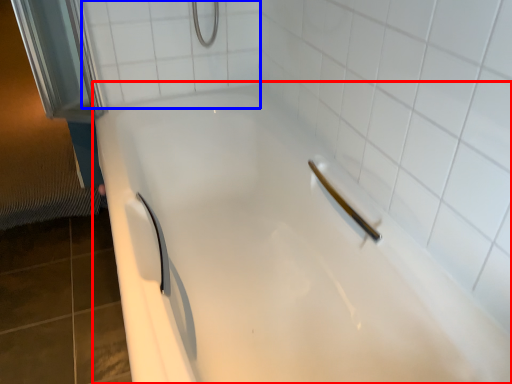
Question: Which object appears farthest to the camera in this image, bathtub (highlighted by a red box) or ceramic tile (highlighted by a blue box)?

Choices:
 (A) bathtub
 (B) ceramic tile

Answer: (B)